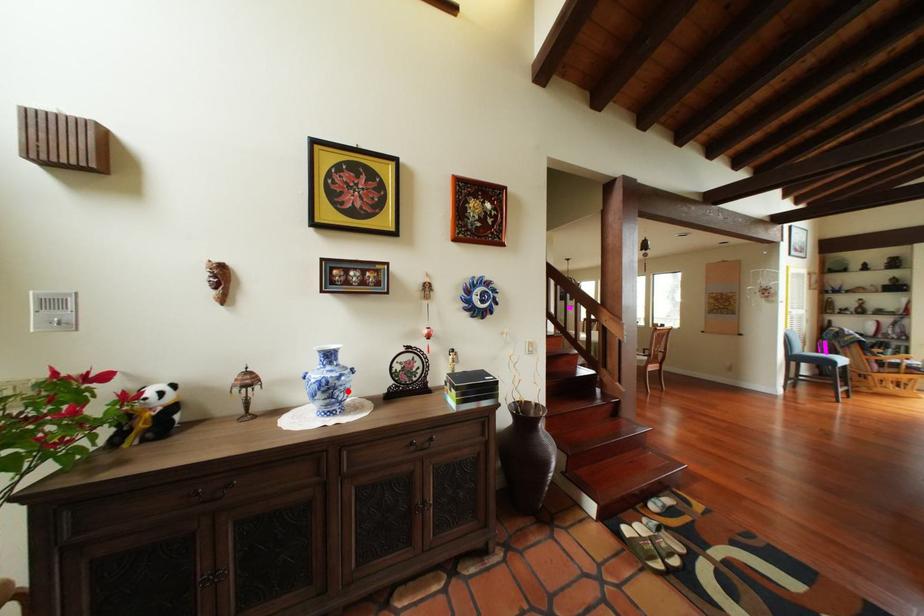
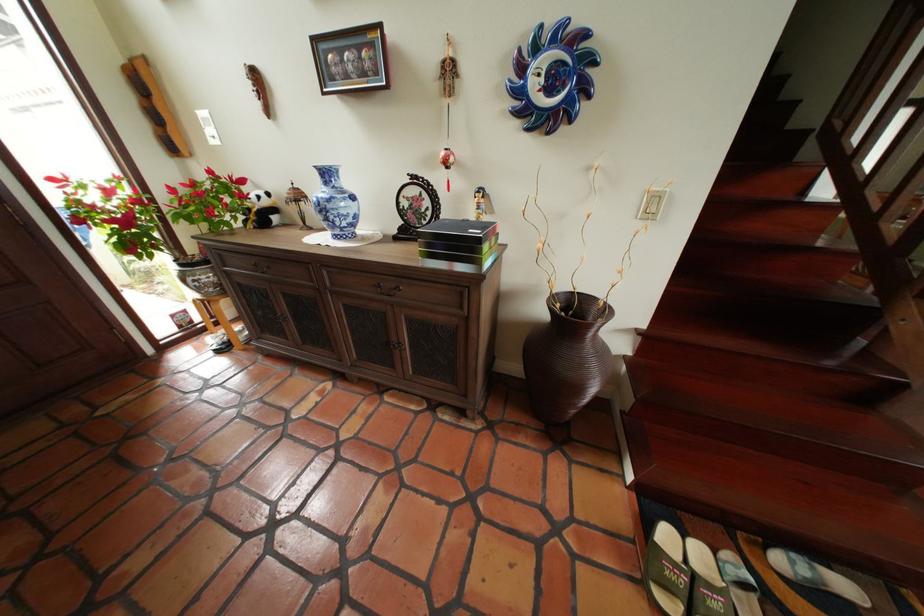
The point at the highlighted location is marked in the first image. Where is the corresponding point in the second image?

(341, 214)